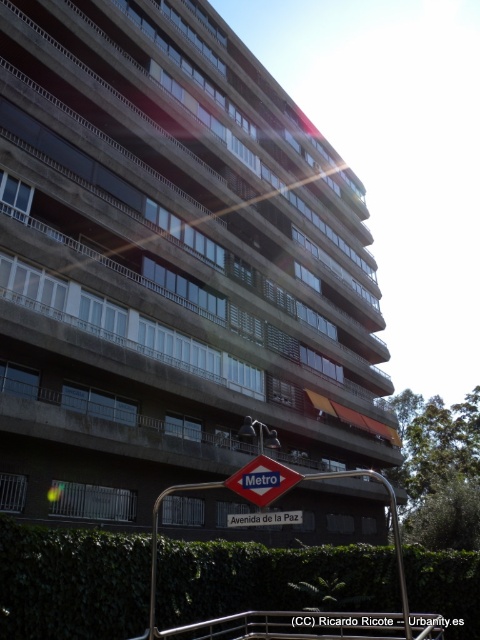
Can you confirm if green leafy hedge at lower center is positioned to the left of metallic diamond-shaped sign at lower center?

Yes, green leafy hedge at lower center is to the left of metallic diamond-shaped sign at lower center.

Between point (34, 548) and point (253, 483), which one is positioned behind?

Point (34, 548)

Describe the element at coordinates (72, 582) in the screenshot. The image size is (480, 640). I see `green leafy hedge at lower center` at that location.

Locate an element on the screen. The width and height of the screenshot is (480, 640). green leafy hedge at lower center is located at coordinates (72, 582).